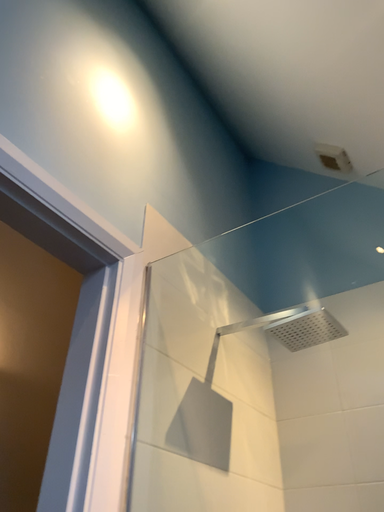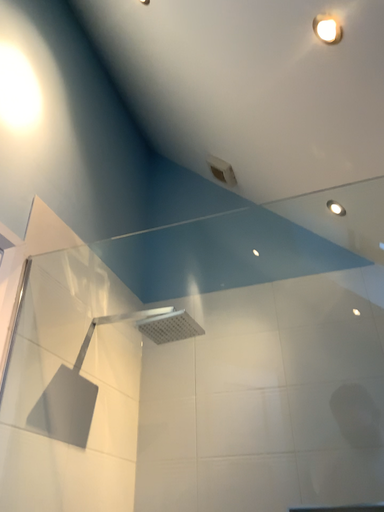
Question: How did the camera likely rotate when shooting the video?

Choices:
 (A) rotated right
 (B) rotated left

Answer: (A)